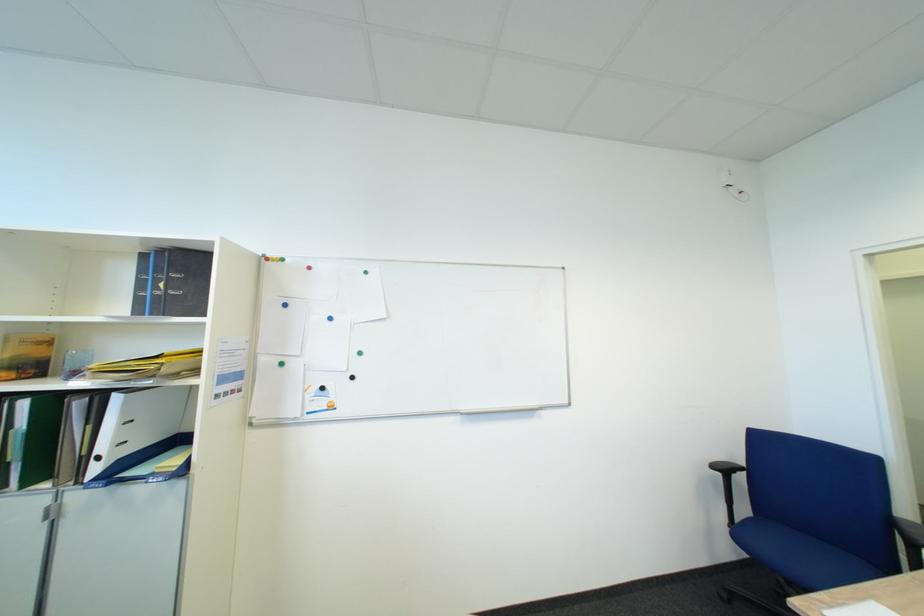
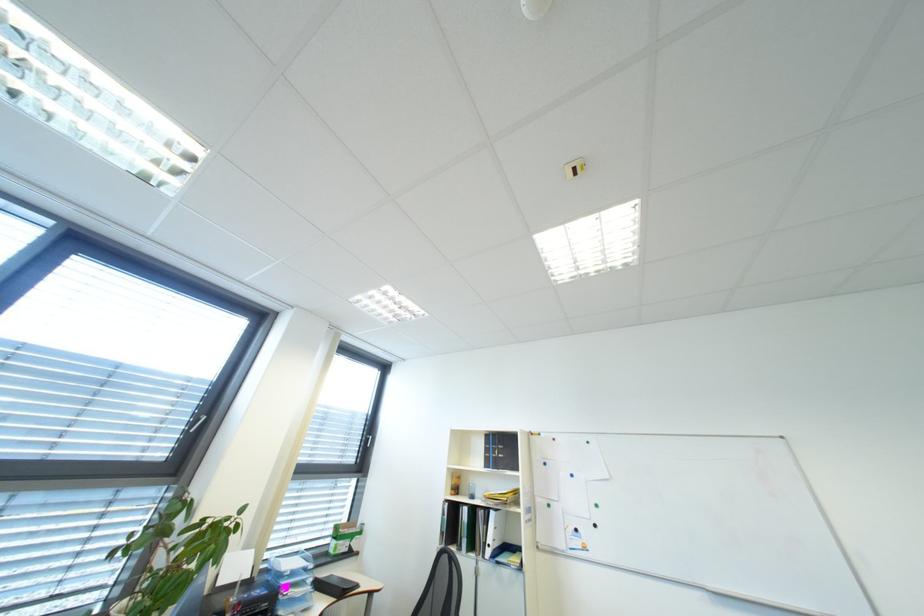
In the second image, find the point that corresponds to [110,459] in the first image.

(500, 546)